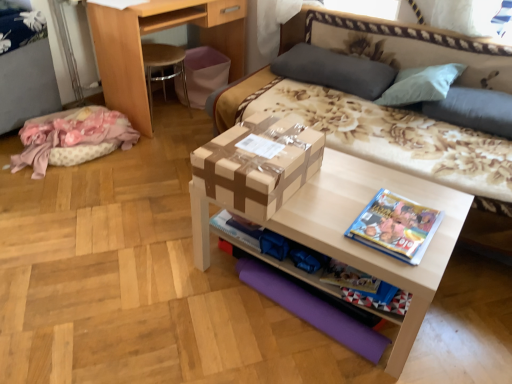
Identify the location of empty space that is to the right of brown cardboard box at center. The image size is (512, 384). (341, 186).